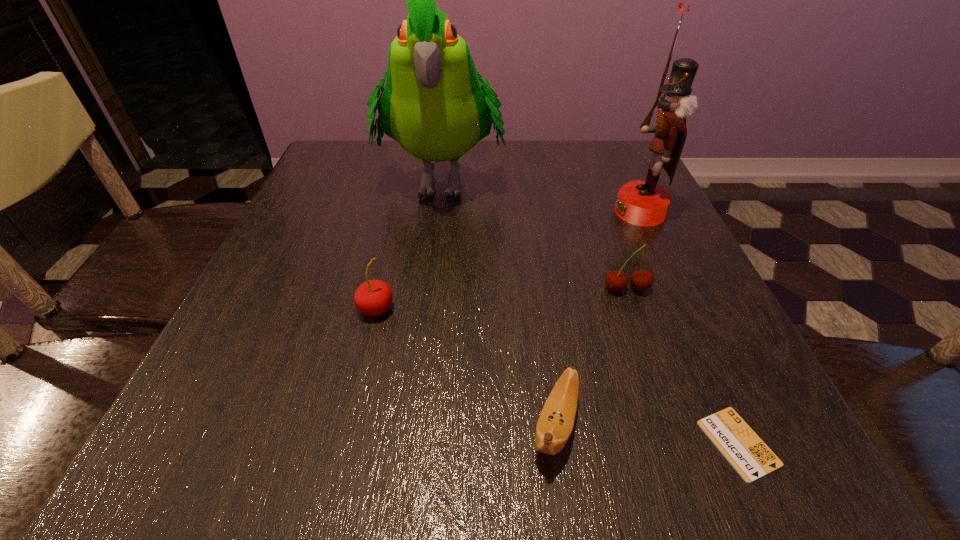
This screenshot has height=540, width=960. Find the location of `free spot that satisfies the following two spatial constraints: 1. on the front-facing side of the nutcracker; 2. on the surface of the right cherry`. free spot that satisfies the following two spatial constraints: 1. on the front-facing side of the nutcracker; 2. on the surface of the right cherry is located at coordinates (676, 289).

Locate an element on the screen. This screenshot has height=540, width=960. free space that satisfies the following two spatial constraints: 1. on the front-facing side of the nutcracker; 2. on the front side of the left cherry is located at coordinates (x=684, y=309).

Where is `blank space that satisfies the following two spatial constraints: 1. on the front-facing side of the nutcracker; 2. on the surface of the right cherry`? blank space that satisfies the following two spatial constraints: 1. on the front-facing side of the nutcracker; 2. on the surface of the right cherry is located at coordinates (676, 289).

The image size is (960, 540). Find the location of `vacant space that satisfies the following two spatial constraints: 1. on the beak of the second shortest object; 2. on the left side of the parakeet`. vacant space that satisfies the following two spatial constraints: 1. on the beak of the second shortest object; 2. on the left side of the parakeet is located at coordinates (412, 424).